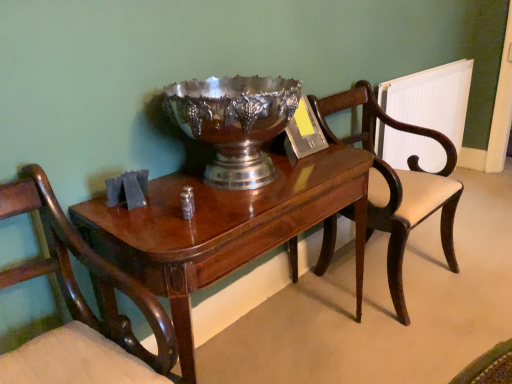
Where is `free region under shiny silver bowl at center (from a real-world perspective)`? free region under shiny silver bowl at center (from a real-world perspective) is located at coordinates (232, 188).